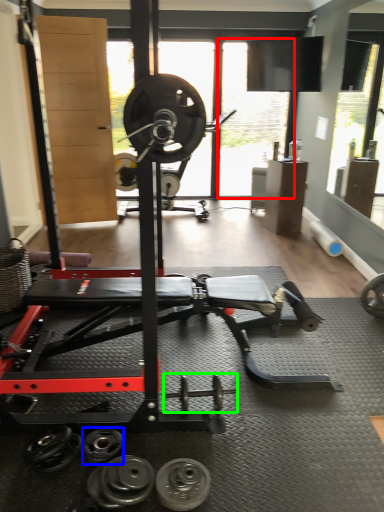
Question: Which is nearer to the window screen (highlighted by a red box)? dumbbell (highlighted by a blue box) or dumbbell (highlighted by a green box).

Choices:
 (A) dumbbell
 (B) dumbbell

Answer: (B)